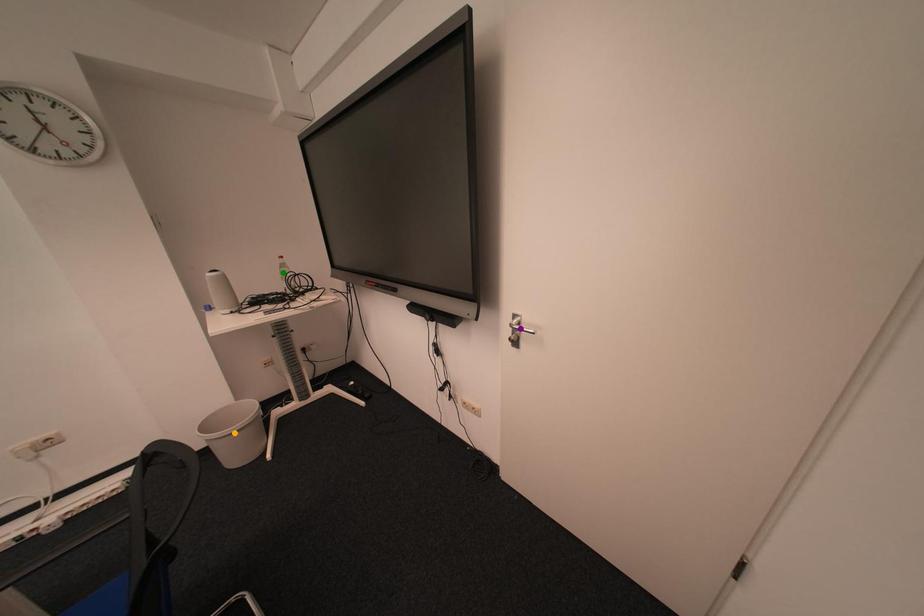
Order these from nearest to farthest:
A) orange point
B) green point
C) purple point

purple point
green point
orange point